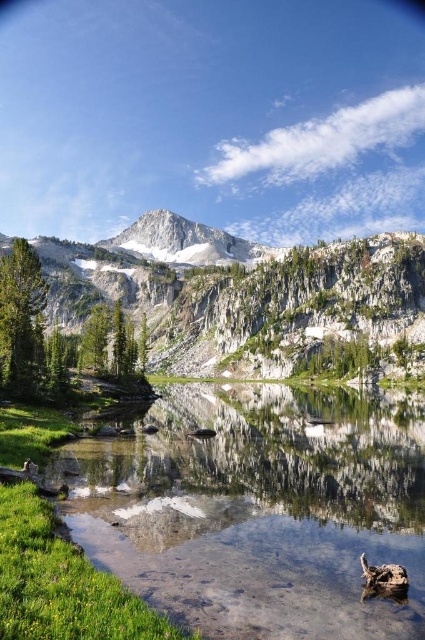
Does clear glass pond at center have a greater width compared to white rocky mountain at center?

No.

Between point (252, 472) and point (334, 244), which one is positioned behind?

The point (334, 244) is more distant.

At what (x,y) coordinates should I click in order to perform the action: click on clear glass pond at center. Please return your answer as a coordinate pair (x, y). Image resolution: width=425 pixels, height=640 pixels. Looking at the image, I should click on (258, 509).

Who is positioned more to the left, white rocky mountain at center or white snow-covered mountain at center?

white rocky mountain at center is more to the left.

Between point (207, 326) and point (193, 234), which one is positioned behind?

Positioned behind is point (193, 234).

Does point (180, 321) come in front of point (248, 248)?

Yes, point (180, 321) is closer to viewer.

The image size is (425, 640). Find the location of `white rocky mountain at center`. white rocky mountain at center is located at coordinates (241, 292).

Describe the element at coordinates (258, 509) in the screenshot. I see `clear glass pond at center` at that location.

Who is more distant from viewer, (198,580) or (189,262)?

Positioned behind is point (189,262).

This screenshot has height=640, width=425. Describe the element at coordinates (258, 509) in the screenshot. I see `clear glass pond at center` at that location.

Where is `clear glass pond at center`? The width and height of the screenshot is (425, 640). clear glass pond at center is located at coordinates (258, 509).